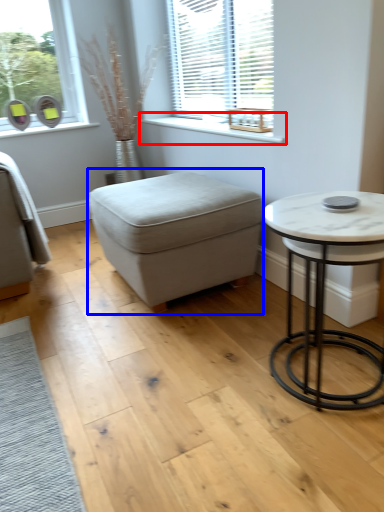
Question: Which object is closer to the camera taking this photo, window sill (highlighted by a red box) or music stool (highlighted by a blue box)?

Choices:
 (A) window sill
 (B) music stool

Answer: (B)